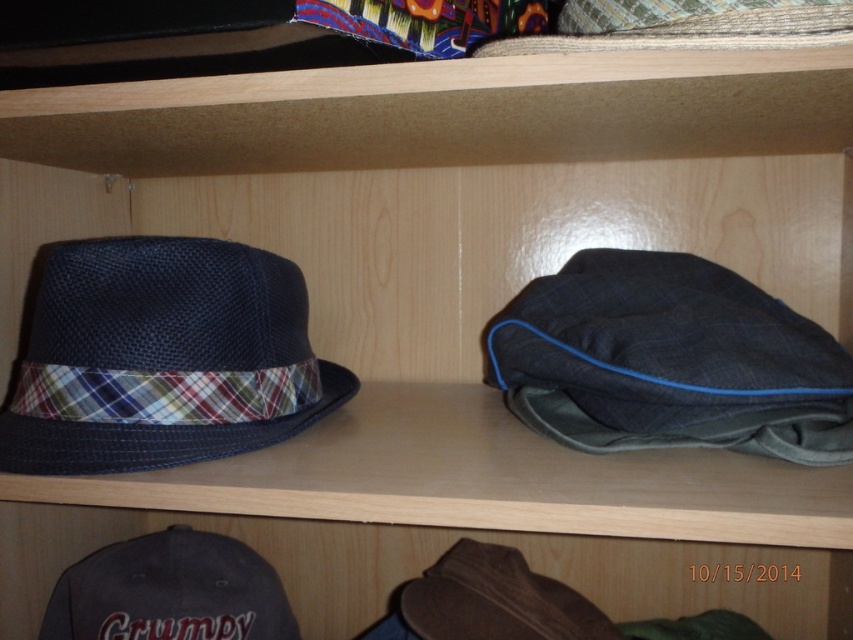
Question: Among these objects, which one is nearest to the camera?

Choices:
 (A) dark blue woven hat at left
 (B) brown leather cowboy hat at lower center

Answer: (A)

Question: Can you confirm if dark gray fabric cap at lower left is smaller than brown leather cowboy hat at lower center?

Choices:
 (A) yes
 (B) no

Answer: (B)

Question: Among these points, which one is nearest to the camera?

Choices:
 (A) (451, 614)
 (B) (67, 579)

Answer: (A)

Question: Which point is closer to the camera taking this photo?

Choices:
 (A) (566, 612)
 (B) (166, 612)
 (C) (33, 364)

Answer: (C)

Question: Is dark gray fabric cap at lower left wider than brown leather cowboy hat at lower center?

Choices:
 (A) yes
 (B) no

Answer: (A)

Question: Is dark blue woven hat at left positioned before dark gray fabric cap at lower left?

Choices:
 (A) no
 (B) yes

Answer: (B)